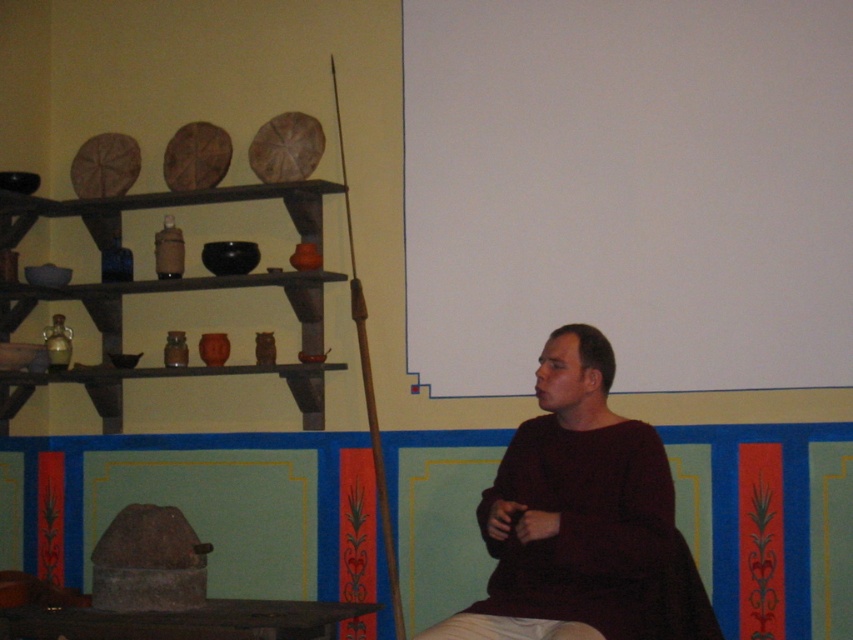
Find the location of a particular element. Image resolution: width=853 pixels, height=640 pixels. dark brown sweater at center is located at coordinates (581, 518).

From the picture: Which of these two, dark brown sweater at center or brown wood shelves at left, stands shorter?

With less height is dark brown sweater at center.

Describe the element at coordinates (581, 518) in the screenshot. I see `dark brown sweater at center` at that location.

Where is `dark brown sweater at center`? This screenshot has width=853, height=640. dark brown sweater at center is located at coordinates point(581,518).

Can you confirm if white matte projection screen at upper center is bigger than dark brown sweater at center?

Yes, white matte projection screen at upper center is bigger than dark brown sweater at center.

Is white matte projection screen at upper center smaller than dark brown sweater at center?

Incorrect, white matte projection screen at upper center is not smaller in size than dark brown sweater at center.

Does point (761, 26) come closer to viewer compared to point (662, 541)?

No, (761, 26) is behind (662, 541).

The width and height of the screenshot is (853, 640). Find the location of `white matte projection screen at upper center`. white matte projection screen at upper center is located at coordinates (630, 189).

Is point (683, 24) positioned in front of point (107, 211)?

Yes.

Is white matte projection screen at upper center smaller than brown wood shelves at left?

Actually, white matte projection screen at upper center might be larger than brown wood shelves at left.

This screenshot has height=640, width=853. Identify the location of white matte projection screen at upper center. (630, 189).